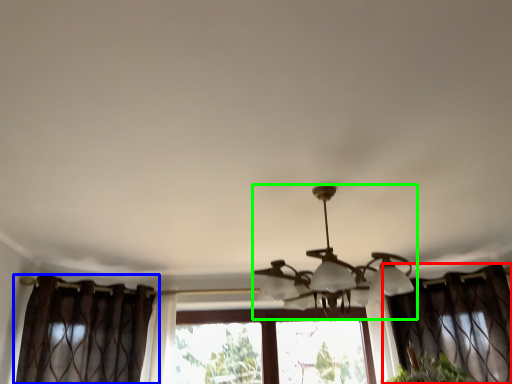
Question: Which object is the farthest from curtain (highlighted by a red box)? Choose among these: curtain (highlighted by a blue box) or lamp (highlighted by a green box).

Choices:
 (A) curtain
 (B) lamp

Answer: (A)